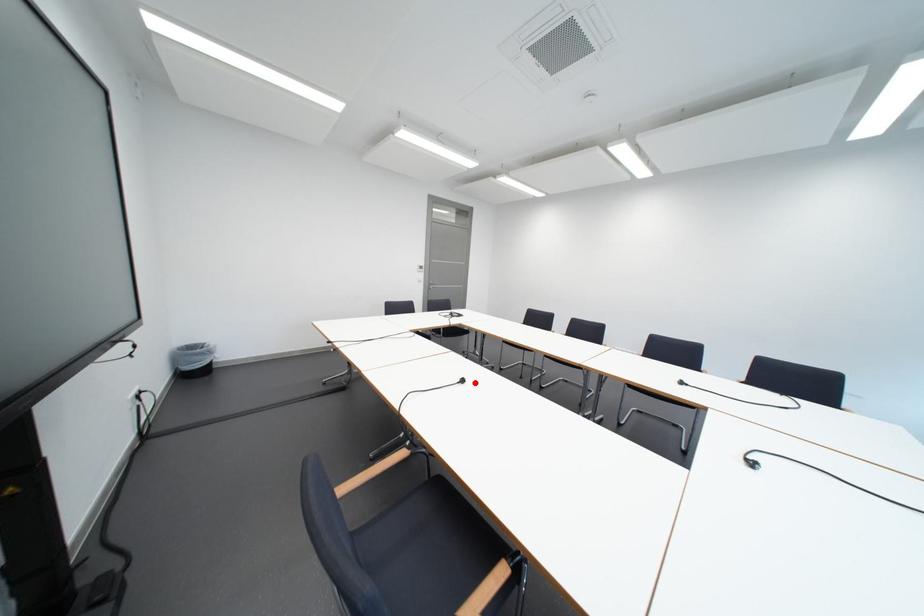
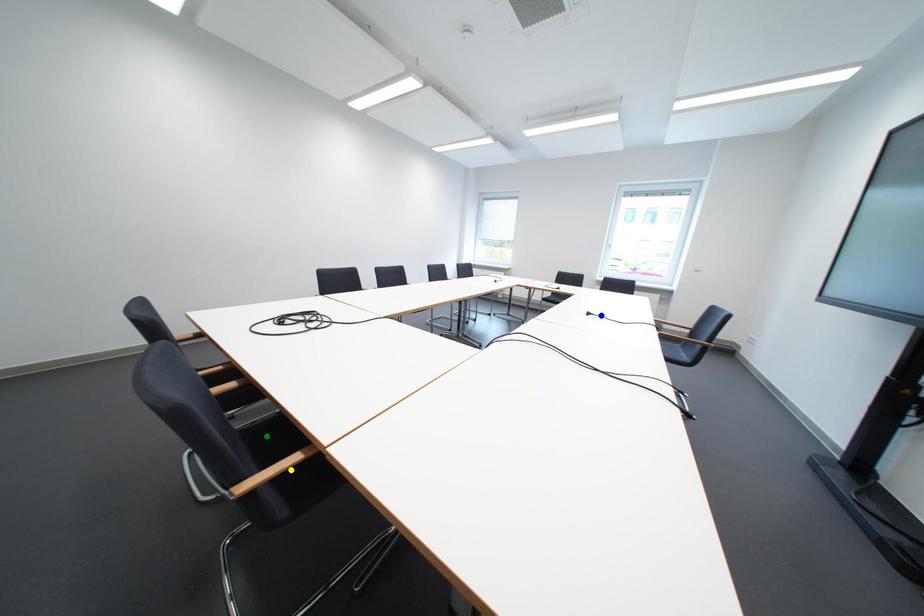
Question: I am providing you with two images of the same scene from different viewpoints. A red point is marked on the first image. You are given multiple points on the second image. Which mark in image 2 goes with the point in image 1?

Choices:
 (A) blue point
 (B) yellow point
 (C) green point

Answer: (A)